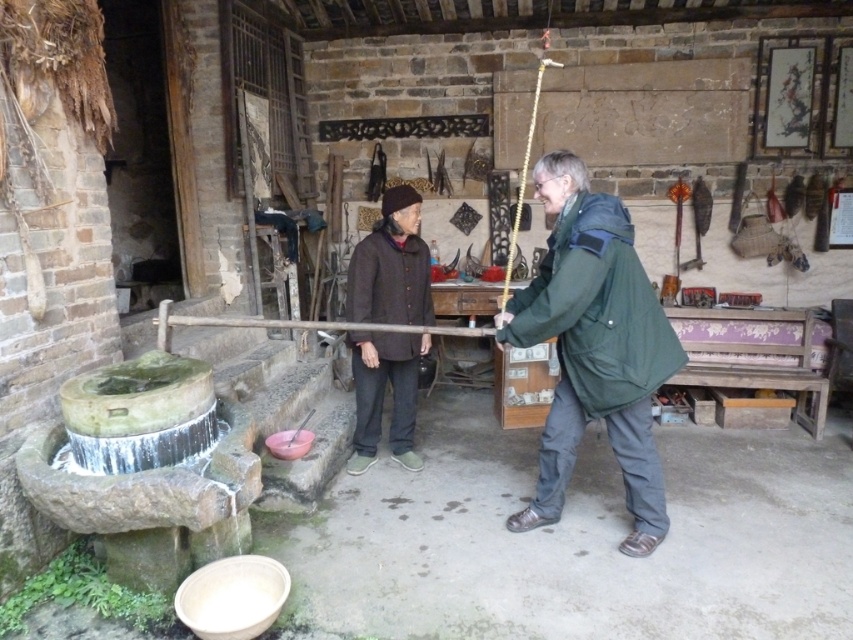
You are an assistant helping to organize clothing in this traditional Chinese courtyard. You need to place the green matte jacket at center and the brown woolen sweater at center on a rack. If the rack has a height limit of 1 meter, can both items be placed without exceeding the rack?

The green matte jacket at center has a greater height compared to brown woolen sweater at center. Since the rack has a height limit of 1 meter, both items can be placed on the rack as long as their individual heights do not exceed 1 meter. However, without specific measurements, we can only confirm that the taller item, the green matte jacket at center, must be under 1 meter for both to fit.

You are a visitor in this courtyard and want to take a photo of the green matte jacket at center and the brown woolen sweater at center. Which one is closer to the camera?

The green matte jacket at center is positioned under the brown woolen sweater at center, so the brown woolen sweater at center is closer to the camera.